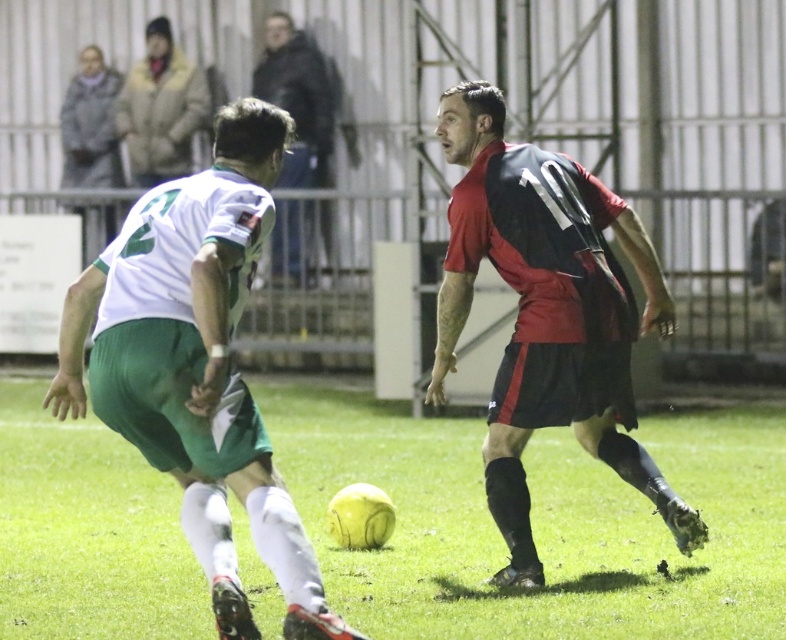
You are a photographer standing at the edge of the soccer field. You want to take a closeup photo of the green matte shorts at center. Can you estimate how far you need to walk forward to get the shorts into focus without zooming?

The green matte shorts at center is 5.96 meters from camera. To get it into focus, you need to walk forward until you are about 5.96 meters away from the shorts.

You are a soccer coach analyzing the game from the sidelines. The field is divided into a grid with coordinates from 0 to 1 on both axes. The goal is located at coordinate 1 on the x and y axes. Based on the yellow matte soccer ball at center position at point 0.819, 0.688, which direction should the player in the red jersey with black shorts move to reach the ball first?

The yellow matte soccer ball at center is located at coordinate point (540, 524). Since the goal is at coordinate 1 on both axes, the player in the red jersey with black shorts should move towards the ball by heading towards the higher x and y coordinates to reach it first.